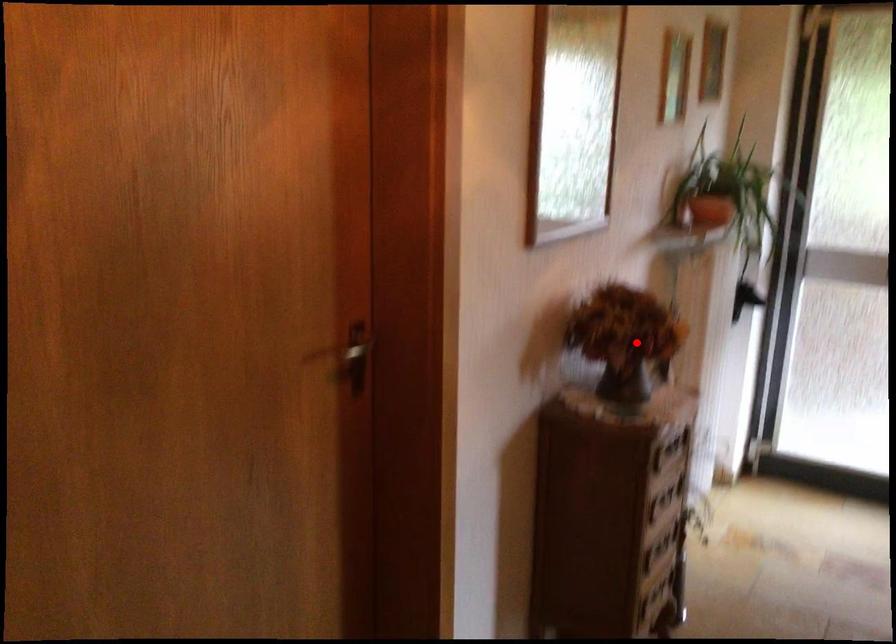
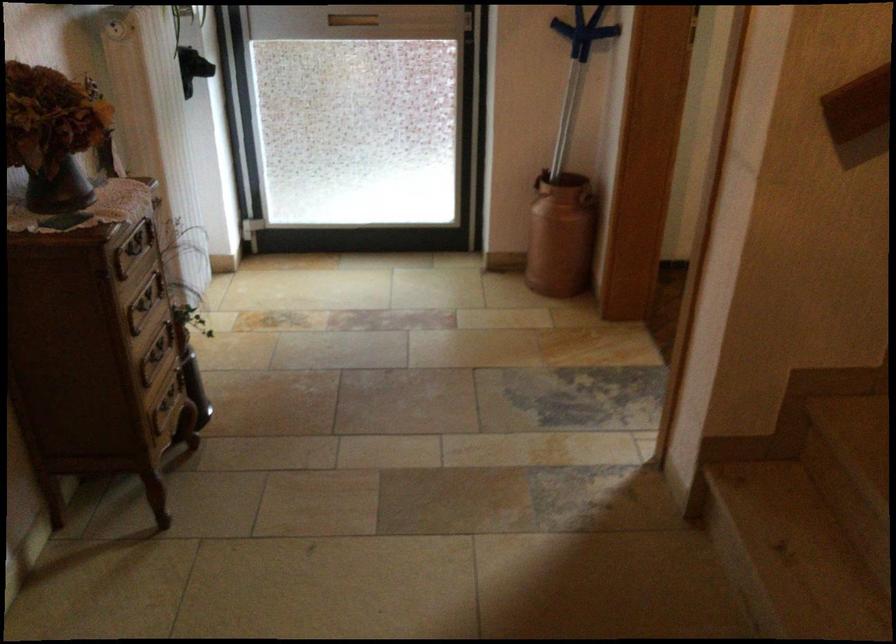
Where in the second image is the point corresponding to the highlighted location from the first image?

(53, 134)